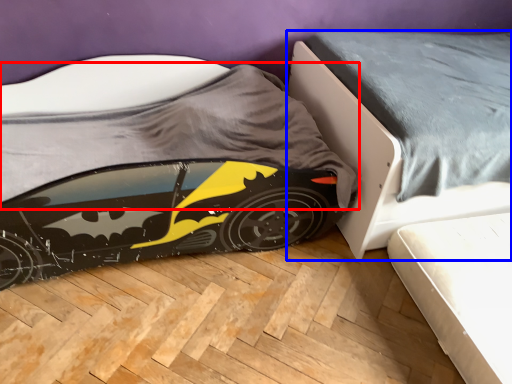
Question: Which of the following is the farthest to the observer, sheet (highlighted by a red box) or bed (highlighted by a blue box)?

Choices:
 (A) sheet
 (B) bed

Answer: (B)